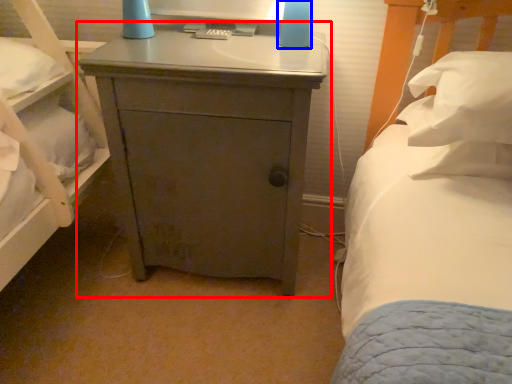
Question: Which object appears closest to the camera in this image, nightstand (highlighted by a red box) or bedside lamp (highlighted by a blue box)?

Choices:
 (A) nightstand
 (B) bedside lamp

Answer: (A)